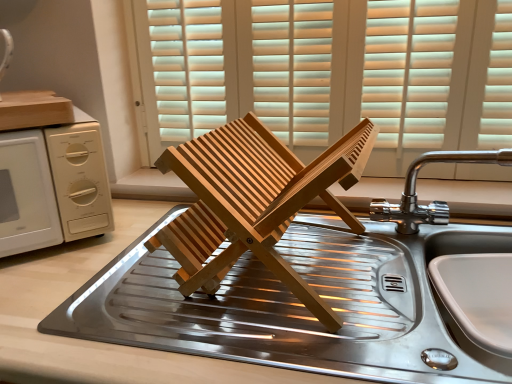
Question: Does chrome metallic faucet at upper right appear on the left side of white matte microwave at left?

Choices:
 (A) no
 (B) yes

Answer: (A)

Question: From the image's perspective, would you say chrome metallic faucet at upper right is positioned over white matte microwave at left?

Choices:
 (A) yes
 (B) no

Answer: (B)

Question: Is white matte microwave at left completely or partially inside chrome metallic faucet at upper right?

Choices:
 (A) no
 (B) yes

Answer: (A)

Question: Can you confirm if chrome metallic faucet at upper right is smaller than white matte microwave at left?

Choices:
 (A) yes
 (B) no

Answer: (A)

Question: Would you say chrome metallic faucet at upper right is outside white matte microwave at left?

Choices:
 (A) no
 (B) yes

Answer: (B)

Question: From the image's perspective, is white matte microwave at left above or below stainless steel sink at center?

Choices:
 (A) above
 (B) below

Answer: (A)

Question: Does point (69, 236) appear closer or farther from the camera than point (310, 233)?

Choices:
 (A) closer
 (B) farther

Answer: (A)

Question: Is white matte microwave at left spatially inside stainless steel sink at center, or outside of it?

Choices:
 (A) inside
 (B) outside

Answer: (B)

Question: In the image, is white matte microwave at left positioned in front of or behind stainless steel sink at center?

Choices:
 (A) behind
 (B) front

Answer: (A)

Question: Which is correct: wooden blinds at center is inside stainless steel sink at center, or outside of it?

Choices:
 (A) inside
 (B) outside

Answer: (B)

Question: Is wooden blinds at center wider or thinner than stainless steel sink at center?

Choices:
 (A) wide
 (B) thin

Answer: (B)

Question: From the image's perspective, is wooden blinds at center positioned above or below stainless steel sink at center?

Choices:
 (A) above
 (B) below

Answer: (A)

Question: Is wooden blinds at center to the left or to the right of stainless steel sink at center in the image?

Choices:
 (A) left
 (B) right

Answer: (B)

Question: Considering the positions of point (57, 228) and point (219, 23), is point (57, 228) closer or farther from the camera than point (219, 23)?

Choices:
 (A) farther
 (B) closer

Answer: (B)

Question: Is white matte microwave at left inside the boundaries of wooden blinds at center, or outside?

Choices:
 (A) outside
 (B) inside

Answer: (A)